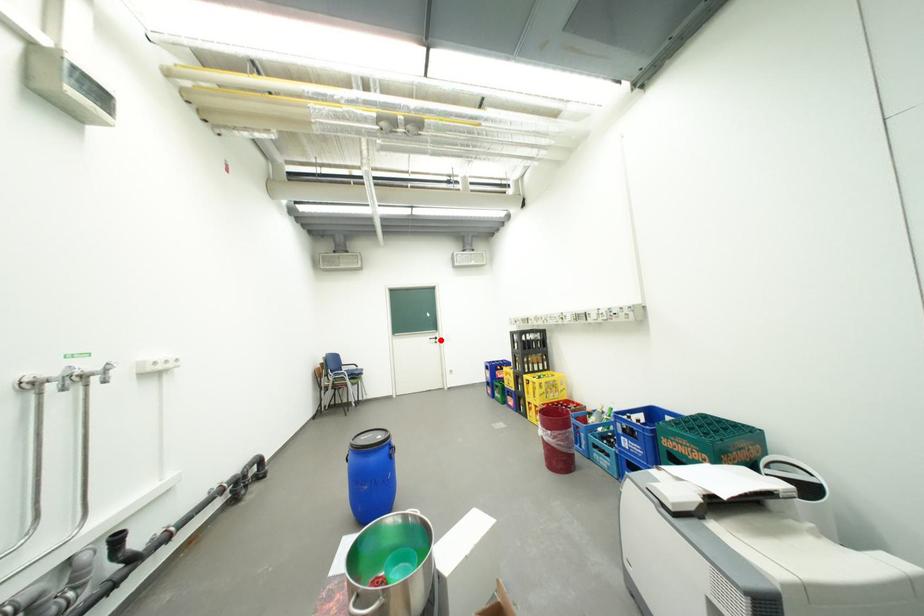
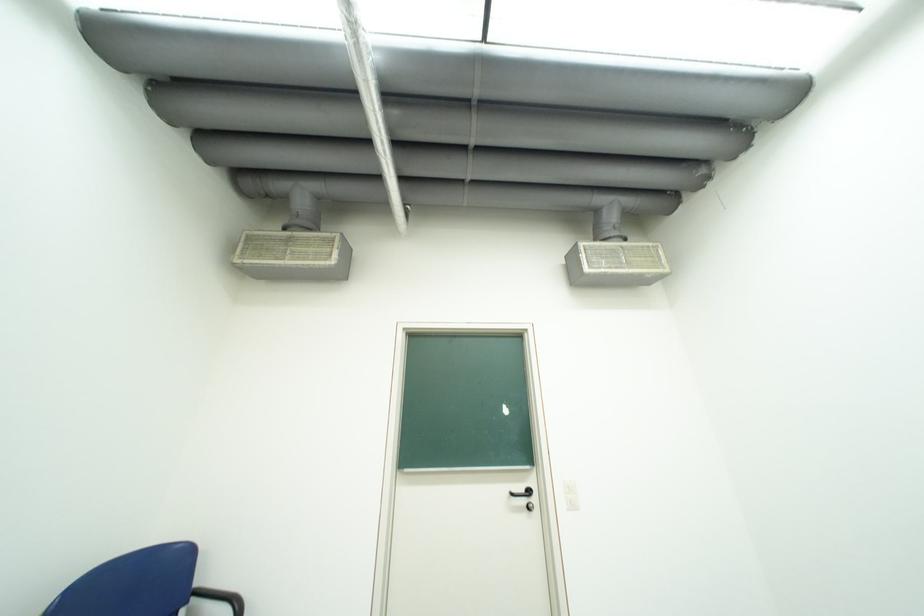
Question: I am providing you with two images of the same scene from different viewpoints. Image1 has a red point marked. In image2, the corresponding 3D location appears at what relative position? Reply with the corresponding letter.

Choices:
 (A) Closer
 (B) Farther

Answer: (B)